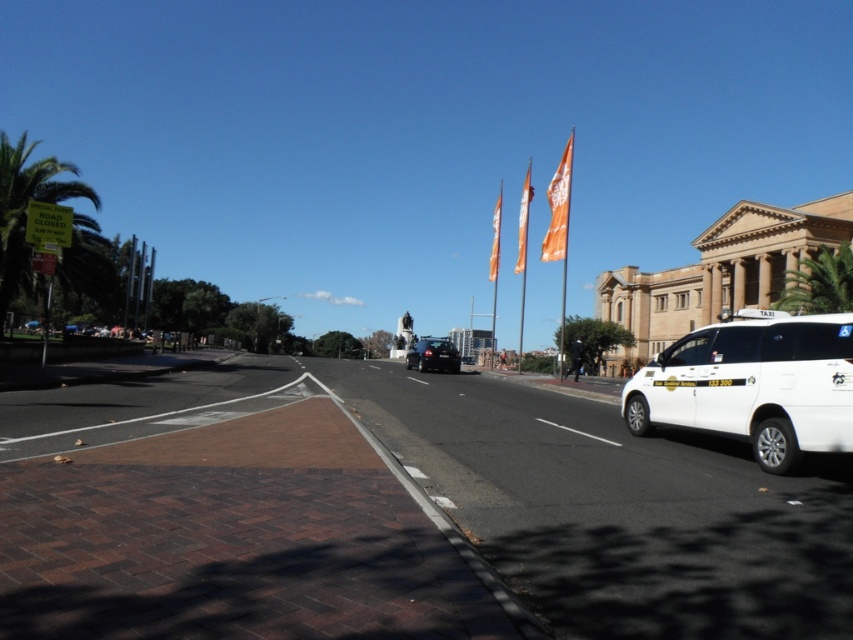
Question: Considering the real-world distances, which object is farthest from the green leafy palm tree at right?

Choices:
 (A) green leafy palm tree at left
 (B) orange fabric flag at upper right
 (C) shiny black sedan at center
 (D) white glossy taxi at right

Answer: (A)

Question: Does green leafy palm tree at right have a larger size compared to orange fabric flag at center?

Choices:
 (A) no
 (B) yes

Answer: (A)

Question: Which point appears farthest from the camera in this image?

Choices:
 (A) (550, 244)
 (B) (671, 348)
 (C) (416, 353)
 (D) (787, 305)

Answer: (D)

Question: Can you confirm if orange fabric flag at upper right is thinner than orange fabric flag at center?

Choices:
 (A) no
 (B) yes

Answer: (A)

Question: Can you confirm if green leafy palm tree at left is wider than orange fabric flag at upper center?

Choices:
 (A) no
 (B) yes

Answer: (B)

Question: Which point is closer to the camera taking this photo?

Choices:
 (A) (529, 168)
 (B) (498, 236)
 (C) (552, 236)
 (D) (624, 412)

Answer: (D)